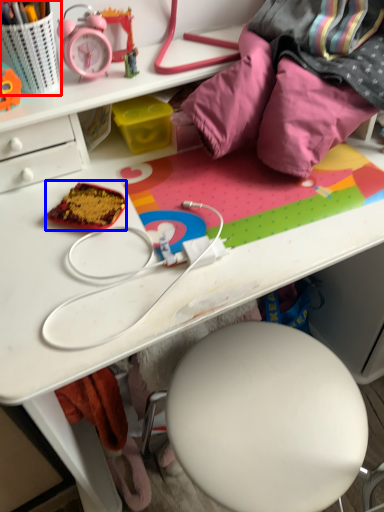
Question: Among these objects, which one is farthest to the camera, stationery (highlighted by a red box) or stuff (highlighted by a blue box)?

Choices:
 (A) stationery
 (B) stuff

Answer: (B)